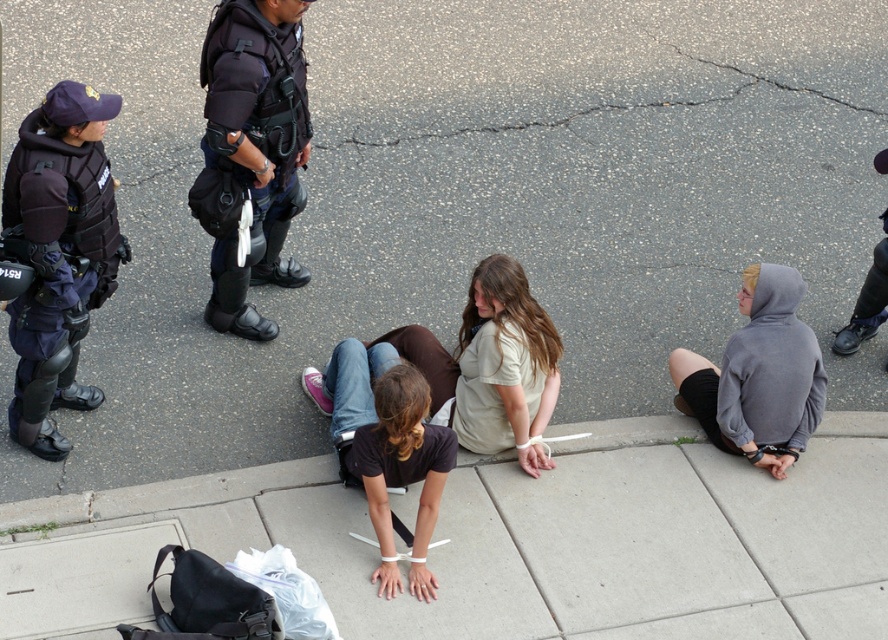
You are a delivery person trying to place a gray hoodie at lower right and a concrete at lower center in your truck. Which item should you place first if you want to maximize the space in your truck?

The gray hoodie at lower right has a larger size compared to concrete at lower center, so you should place the gray hoodie at lower right first to maximize space in the truck.

From the picture: You are a police officer trying to identify the individual in the center of the sidewalk. Which person is wearing the dark brown shirt at center?

The dark brown shirt at center is located at point [385,445], so the individual wearing the dark brown shirt at center is positioned at that coordinate.

You are a pedestrian on the sidewalk and see the dark brown shirt at center and the gray hoodie at lower right. Which one is closer to the left side of the sidewalk?

The dark brown shirt at center is closer to the left side of the sidewalk because it is positioned to the left of the gray hoodie at lower right.